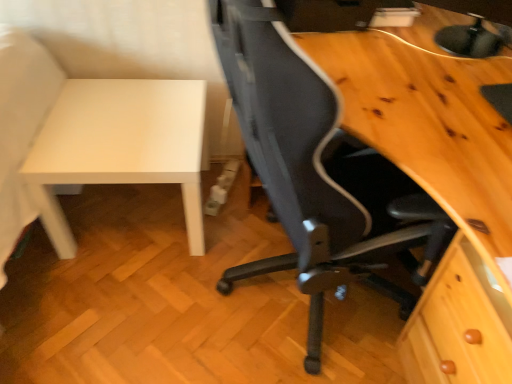
Question: From the image's perspective, relative to white matte table at left, is matte black monitor at upper right above or below?

Choices:
 (A) above
 (B) below

Answer: (A)

Question: Is matte black monitor at upper right to the left or to the right of white matte table at left in the image?

Choices:
 (A) left
 (B) right

Answer: (B)

Question: Based on their relative distances, which object is farther from the white matte table at left?

Choices:
 (A) black mesh chair at center
 (B) matte black monitor at upper right

Answer: (B)

Question: Based on their relative distances, which object is nearer to the matte black monitor at upper right?

Choices:
 (A) white matte table at left
 (B) black mesh chair at center

Answer: (B)